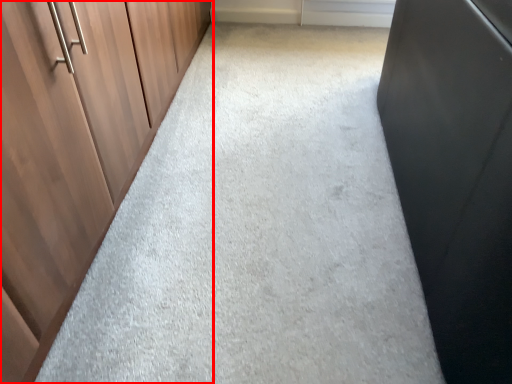
Question: From the image's perspective, what is the correct spatial positioning of cupboard (annotated by the red box) in reference to window?

Choices:
 (A) above
 (B) below

Answer: (B)